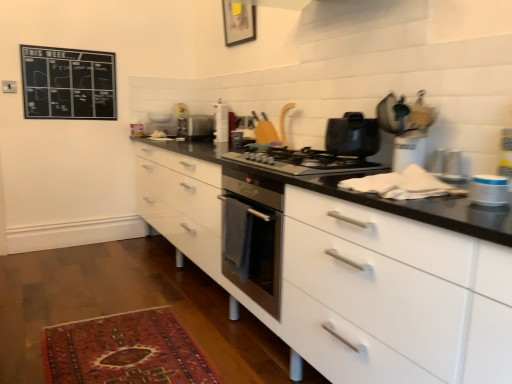
This screenshot has height=384, width=512. Find the location of `free space above carpeted rug at lower left (from a real-world perspective)`. free space above carpeted rug at lower left (from a real-world perspective) is located at coordinates (125, 345).